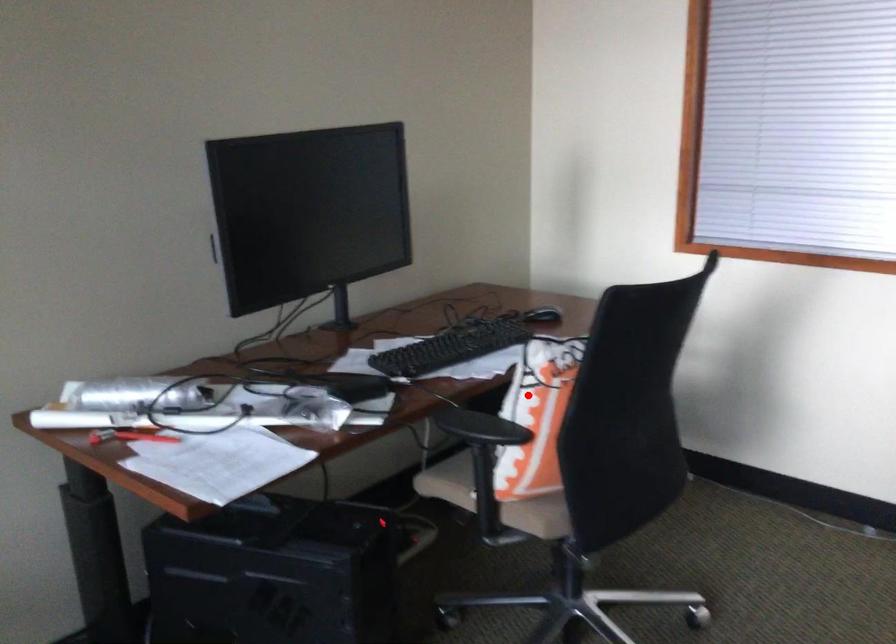
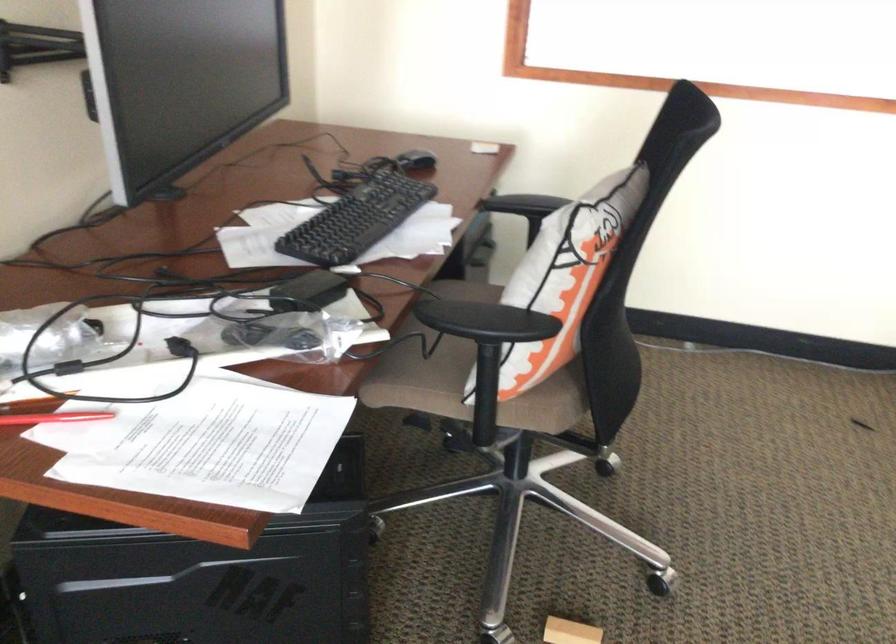
Question: I am providing you with two images of the same scene from different viewpoints. Image1 has a red point marked. In image2, the corresponding 3D location appears at what relative position? Reply with the corresponding letter.

Choices:
 (A) Closer
 (B) Farther

Answer: (A)